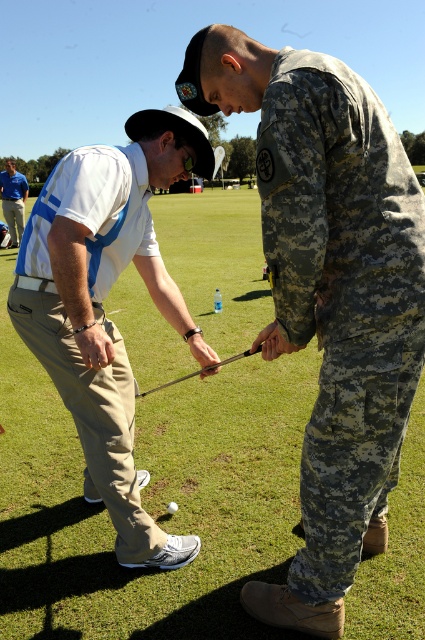
Does green grass at center appear on the right side of white matte golf club at center?

No, green grass at center is not to the right of white matte golf club at center.

Between point (166, 627) and point (184, 304), which one is positioned behind?

Positioned behind is point (184, 304).

Between point (73, 541) and point (147, 170), which one is positioned behind?

The point (73, 541) is more distant.

You are a GUI agent. You are given a task and a screenshot of the screen. Output one action in this format:
    pyautogui.click(x=<x>, y=<y>)
    Task: Click on the green grass at center
    This screenshot has width=425, height=640.
    Given the screenshot: What is the action you would take?
    pyautogui.click(x=150, y=500)

Who is positioned more to the right, green grass at center or metallic shaft at center?

metallic shaft at center is more to the right.

Based on the photo, is the position of green grass at center more distant than that of metallic shaft at center?

No, green grass at center is in front of metallic shaft at center.

Is point (11, 513) positioned before point (244, 349)?

Yes, it is in front of point (244, 349).

Where is `green grass at center`? This screenshot has width=425, height=640. green grass at center is located at coordinates (150, 500).

Is white matte golf club at center thinner than metallic shaft at center?

Incorrect, white matte golf club at center's width is not less than metallic shaft at center's.

You are a GUI agent. You are given a task and a screenshot of the screen. Output one action in this format:
    pyautogui.click(x=<x>, y=<y>)
    Task: Click on the white matte golf club at center
    This screenshot has height=640, width=425.
    Given the screenshot: What is the action you would take?
    pyautogui.click(x=102, y=307)

Which is in front, point (90, 467) or point (244, 353)?

Positioned in front is point (244, 353).

The height and width of the screenshot is (640, 425). Find the location of `white matte golf club at center`. white matte golf club at center is located at coordinates (102, 307).